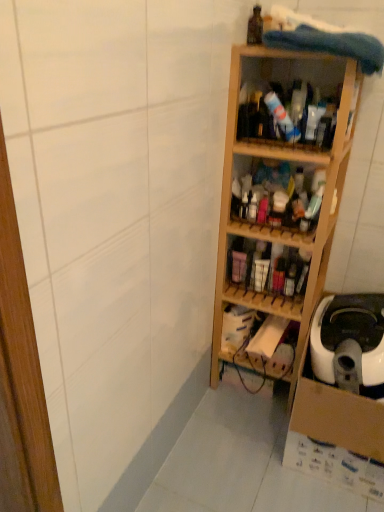
This screenshot has width=384, height=512. What do you see at coordinates (278, 199) in the screenshot?
I see `wooden shelves at center, acting as the fourth shelf starting from the bottom` at bounding box center [278, 199].

What is the approximate width of light wood shelf at center, which ranks as the third shelf in bottom-to-top order?

It is 15.37 inches.

Find the location of a particular element. Image resolution: width=384 pixels, height=512 pixels. wooden shelf at center, marked as the 1th shelf in a bottom-to-top arrangement is located at coordinates (259, 339).

Where is `wooden shelves at center, which ranks as the 2th shelf in bottom-to-top order`? The width and height of the screenshot is (384, 512). wooden shelves at center, which ranks as the 2th shelf in bottom-to-top order is located at coordinates (267, 270).

At what (x,y) coordinates should I click in order to perform the action: click on wooden shelves at center, the second shelf viewed from the top. Please return your answer as a coordinate pair (x, y). Looking at the image, I should click on (278, 199).

From the image's perspective, which is below, wooden shelves at center, acting as the fourth shelf starting from the bottom, or wooden shelves at center, the fourth shelf positioned from the top?

wooden shelves at center, the fourth shelf positioned from the top, from the image's perspective.

Considering the relative positions of wooden shelves at center, acting as the fourth shelf starting from the bottom, and wooden shelves at center, the fourth shelf positioned from the top, in the image provided, is wooden shelves at center, acting as the fourth shelf starting from the bottom, to the right of wooden shelves at center, the fourth shelf positioned from the top, from the viewer's perspective?

Incorrect, wooden shelves at center, acting as the fourth shelf starting from the bottom, is not on the right side of wooden shelves at center, the fourth shelf positioned from the top.

Does wooden shelves at center, acting as the fourth shelf starting from the bottom, have a greater width compared to wooden shelves at center, which ranks as the 2th shelf in bottom-to-top order?

Yes, wooden shelves at center, acting as the fourth shelf starting from the bottom, is wider than wooden shelves at center, which ranks as the 2th shelf in bottom-to-top order.

Which point is more distant from viewer, (x=277, y=187) or (x=286, y=298)?

Point (x=277, y=187)

From the picture: Is wooden shelf at center, which is the 1th shelf from top to bottom, completely or partially outside of wooden shelves at center, the second shelf viewed from the top?

Indeed, wooden shelf at center, which is the 1th shelf from top to bottom, is completely outside wooden shelves at center, the second shelf viewed from the top.

Is wooden shelf at center, the fifth shelf positioned from the bottom, thinner than wooden shelves at center, the second shelf viewed from the top?

Incorrect, the width of wooden shelf at center, the fifth shelf positioned from the bottom, is not less than that of wooden shelves at center, the second shelf viewed from the top.

Is the position of wooden shelf at center, which is the 1th shelf from top to bottom, less distant than that of wooden shelves at center, the second shelf viewed from the top?

Yes, it is.

From the image's perspective, is wooden shelf at center, the fifth shelf positioned from the bottom, on wooden shelves at center, acting as the fourth shelf starting from the bottom?

Yes, from the image's perspective, wooden shelf at center, the fifth shelf positioned from the bottom, is over wooden shelves at center, acting as the fourth shelf starting from the bottom.

Does wooden shelves at center, which ranks as the 2th shelf in bottom-to-top order, turn towards wooden shelves at center, acting as the fourth shelf starting from the bottom?

No, wooden shelves at center, which ranks as the 2th shelf in bottom-to-top order, is not aimed at wooden shelves at center, acting as the fourth shelf starting from the bottom.

Can you confirm if wooden shelves at center, the fourth shelf positioned from the top, is positioned to the left of wooden shelves at center, acting as the fourth shelf starting from the bottom?

In fact, wooden shelves at center, the fourth shelf positioned from the top, is to the right of wooden shelves at center, acting as the fourth shelf starting from the bottom.

Is wooden shelves at center, which ranks as the 2th shelf in bottom-to-top order, positioned in front of wooden shelves at center, acting as the fourth shelf starting from the bottom?

No, it is not.

Is wooden shelves at center, the fourth shelf positioned from the top, bigger or smaller than wooden shelves at center, the second shelf viewed from the top?

Clearly, wooden shelves at center, the fourth shelf positioned from the top, is smaller in size than wooden shelves at center, the second shelf viewed from the top.

Based on the photo, from a real-world perspective, which is physically above, wooden shelves at center, the second shelf viewed from the top, or wooden shelf at center, the fifth shelf positioned from the bottom?

wooden shelf at center, the fifth shelf positioned from the bottom.

Considering the relative positions of wooden shelves at center, the second shelf viewed from the top, and wooden shelf at center, which is the 1th shelf from top to bottom, in the image provided, is wooden shelves at center, the second shelf viewed from the top, to the left of wooden shelf at center, which is the 1th shelf from top to bottom, from the viewer's perspective?

Yes, wooden shelves at center, the second shelf viewed from the top, is to the left of wooden shelf at center, which is the 1th shelf from top to bottom.

Can you confirm if wooden shelves at center, acting as the fourth shelf starting from the bottom, is bigger than wooden shelf at center, the fifth shelf positioned from the bottom?

Incorrect, wooden shelves at center, acting as the fourth shelf starting from the bottom, is not larger than wooden shelf at center, the fifth shelf positioned from the bottom.

Is point (297, 335) behind point (305, 142)?

Yes, point (297, 335) is behind point (305, 142).

Which object is closer to the camera, wooden shelf at center, which is the fifth shelf from top to bottom, or wooden shelf at center, which is the 1th shelf from top to bottom?

wooden shelf at center, which is the 1th shelf from top to bottom, is more forward.

Considering the relative sizes of wooden shelf at center, marked as the 1th shelf in a bottom-to-top arrangement, and wooden shelf at center, the fifth shelf positioned from the bottom, in the image provided, is wooden shelf at center, marked as the 1th shelf in a bottom-to-top arrangement, wider than wooden shelf at center, the fifth shelf positioned from the bottom,?

Correct, the width of wooden shelf at center, marked as the 1th shelf in a bottom-to-top arrangement, exceeds that of wooden shelf at center, the fifth shelf positioned from the bottom.

Considering the sizes of wooden shelf at center, marked as the 1th shelf in a bottom-to-top arrangement, and wooden shelf at center, the fifth shelf positioned from the bottom, in the image, is wooden shelf at center, marked as the 1th shelf in a bottom-to-top arrangement, taller or shorter than wooden shelf at center, the fifth shelf positioned from the bottom,?

wooden shelf at center, marked as the 1th shelf in a bottom-to-top arrangement, is shorter than wooden shelf at center, the fifth shelf positioned from the bottom.

Which shelf is the 3rd one when counting from the back of the wooden shelf at center, the fifth shelf positioned from the bottom? Please provide its 2D coordinates.

[(267, 270)]

Is wooden shelves at center, the fourth shelf positioned from the top, bigger than wooden shelf at center, the fifth shelf positioned from the bottom?

Incorrect, wooden shelves at center, the fourth shelf positioned from the top, is not larger than wooden shelf at center, the fifth shelf positioned from the bottom.

Is wooden shelves at center, which ranks as the 2th shelf in bottom-to-top order, in front of or behind wooden shelf at center, the fifth shelf positioned from the bottom, in the image?

In the image, wooden shelves at center, which ranks as the 2th shelf in bottom-to-top order, appears behind wooden shelf at center, the fifth shelf positioned from the bottom.

Which of these two, light wood shelf at center, which ranks as the third shelf in bottom-to-top order, or wooden shelf at center, which is the 1th shelf from top to bottom, is smaller?

Smaller between the two is wooden shelf at center, which is the 1th shelf from top to bottom.

Considering the positions of objects light wood shelf at center, which ranks as the third shelf in bottom-to-top order, and wooden shelf at center, the fifth shelf positioned from the bottom, in the image provided, who is more to the left, light wood shelf at center, which ranks as the third shelf in bottom-to-top order, or wooden shelf at center, the fifth shelf positioned from the bottom,?

light wood shelf at center, which ranks as the third shelf in bottom-to-top order.

From the image's perspective, is light wood shelf at center, which ranks as the third shelf in bottom-to-top order, located beneath wooden shelf at center, which is the 1th shelf from top to bottom?

Indeed, from the image's perspective, light wood shelf at center, which ranks as the third shelf in bottom-to-top order, is shown beneath wooden shelf at center, which is the 1th shelf from top to bottom.

The height and width of the screenshot is (512, 384). Identify the location of the 2nd shelf to the left of the wooden shelves at center, the fourth shelf positioned from the top, starting your count from the anchor. (278, 199).

This screenshot has height=512, width=384. In order to click on shelf above the wooden shelves at center, the second shelf viewed from the top (from the image's perspective) in this screenshot , I will do `click(291, 89)`.

Considering their positions, is wooden shelf at center, marked as the 1th shelf in a bottom-to-top arrangement, positioned closer to wooden shelves at center, acting as the fourth shelf starting from the bottom, than wooden shelf at center, the fifth shelf positioned from the bottom?

Among the two, wooden shelf at center, the fifth shelf positioned from the bottom, is located nearer to wooden shelves at center, acting as the fourth shelf starting from the bottom.

Looking at the image, which one is located closer to wooden shelf at center, marked as the 1th shelf in a bottom-to-top arrangement, light wood shelf at center, the third shelf viewed from the top, or wooden shelves at center, the second shelf viewed from the top?

The object closer to wooden shelf at center, marked as the 1th shelf in a bottom-to-top arrangement, is light wood shelf at center, the third shelf viewed from the top.

Looking at the image, which one is located further to wooden shelf at center, which is the fifth shelf from top to bottom, light wood shelf at center, which ranks as the third shelf in bottom-to-top order, or wooden shelf at center, which is the 1th shelf from top to bottom?

The object further to wooden shelf at center, which is the fifth shelf from top to bottom, is wooden shelf at center, which is the 1th shelf from top to bottom.

Which object lies further to the anchor point wooden shelves at center, the second shelf viewed from the top, wooden shelf at center, which is the 1th shelf from top to bottom, or light wood shelf at center, which ranks as the third shelf in bottom-to-top order?

The object further to wooden shelves at center, the second shelf viewed from the top, is wooden shelf at center, which is the 1th shelf from top to bottom.

When comparing their distances from wooden shelves at center, the fourth shelf positioned from the top, does wooden shelf at center, which is the 1th shelf from top to bottom, or wooden shelf at center, which is the fifth shelf from top to bottom, seem closer?

The object closer to wooden shelves at center, the fourth shelf positioned from the top, is wooden shelf at center, which is the fifth shelf from top to bottom.

Estimate the real-world distances between objects in this image. Which object is closer to wooden shelf at center, marked as the 1th shelf in a bottom-to-top arrangement, wooden shelves at center, the second shelf viewed from the top, or wooden shelves at center, which ranks as the 2th shelf in bottom-to-top order?

wooden shelves at center, which ranks as the 2th shelf in bottom-to-top order, is positioned closer to the anchor wooden shelf at center, marked as the 1th shelf in a bottom-to-top arrangement.

Considering their positions, is wooden shelves at center, acting as the fourth shelf starting from the bottom, positioned closer to wooden shelf at center, marked as the 1th shelf in a bottom-to-top arrangement, than light wood shelf at center, the third shelf viewed from the top?

light wood shelf at center, the third shelf viewed from the top, lies closer to wooden shelf at center, marked as the 1th shelf in a bottom-to-top arrangement, than the other object.

When comparing their distances from wooden shelf at center, which is the 1th shelf from top to bottom, does light wood shelf at center, the third shelf viewed from the top, or wooden shelves at center, the fourth shelf positioned from the top, seem closer?

Based on the image, light wood shelf at center, the third shelf viewed from the top, appears to be nearer to wooden shelf at center, which is the 1th shelf from top to bottom.

Where is `shelf that lies between wooden shelf at center, which is the 1th shelf from top to bottom, and light wood shelf at center, which ranks as the third shelf in bottom-to-top order, from top to bottom`? This screenshot has height=512, width=384. shelf that lies between wooden shelf at center, which is the 1th shelf from top to bottom, and light wood shelf at center, which ranks as the third shelf in bottom-to-top order, from top to bottom is located at coordinates (278, 199).